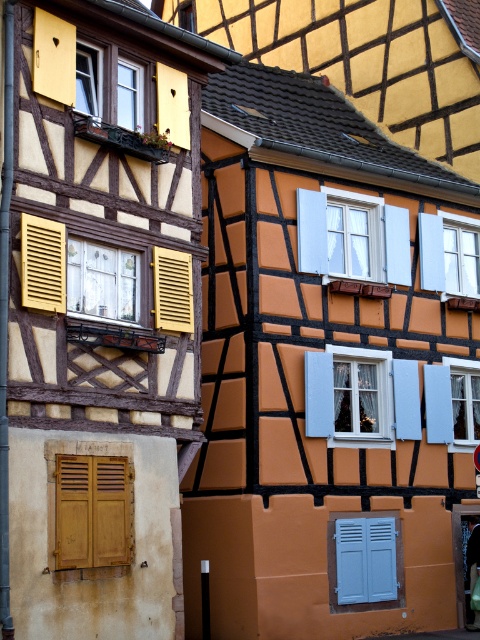
Can you confirm if white matte shutter at center is smaller than matte wood shutter at left?

Incorrect, white matte shutter at center is not smaller in size than matte wood shutter at left.

Does point (370, 241) come closer to viewer compared to point (38, 246)?

No, it is behind (38, 246).

Which is in front, point (312, 198) or point (29, 225)?

Point (29, 225) is more forward.

This screenshot has width=480, height=640. I want to click on white matte shutter at center, so (x=351, y=236).

Is white matte shutter at center bigger than wooden slats at lower left?

Yes.

Is white matte shutter at center wider than wooden slats at lower left?

Correct, the width of white matte shutter at center exceeds that of wooden slats at lower left.

Which is behind, point (299, 257) or point (60, 557)?

Positioned behind is point (299, 257).

Locate an element on the screen. This screenshot has width=480, height=640. white matte shutter at center is located at coordinates (351, 236).

Who is more forward, (60,550) or (63,292)?

Point (60,550) is more forward.

Is point (71, 460) in front of point (50, 244)?

Yes, it is.

This screenshot has height=640, width=480. Identify the location of wooden slats at lower left. (93, 512).